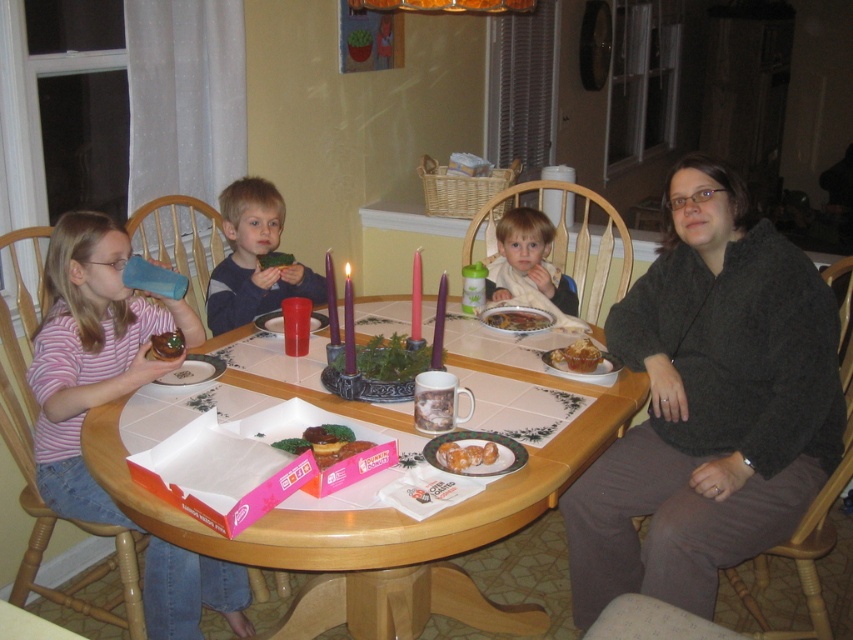
Question: Based on their relative distances, which object is nearer to the smooth beige bib at center?

Choices:
 (A) wooden table at center
 (B) blue plastic cup at center
 (C) golden brown muffin at lower right
 (D) green leafy vegetable at center

Answer: (C)

Question: Which point is farther from the camera taking this photo?

Choices:
 (A) (x=578, y=355)
 (B) (x=486, y=456)
 (C) (x=543, y=285)
 (D) (x=267, y=259)

Answer: (C)

Question: Is chocolate glazed donut at center to the right of golden glazed donut at center from the viewer's perspective?

Choices:
 (A) yes
 (B) no

Answer: (B)

Question: Does matte black sweater at upper right have a lesser width compared to chocolate glazed donut at center?

Choices:
 (A) no
 (B) yes

Answer: (A)

Question: Which point is farther from the camera taking this photo?

Choices:
 (A) (257, 262)
 (B) (558, 316)
 (C) (299, 442)
 (D) (490, 323)

Answer: (A)

Question: Is dark gray sweater at right above green leafy vegetable at center?

Choices:
 (A) no
 (B) yes

Answer: (A)